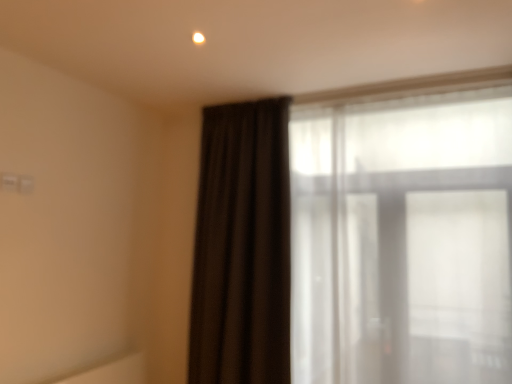
Where is `transparent glass window at center`? transparent glass window at center is located at coordinates (403, 236).

What is the approximate height of transparent glass window at center?

transparent glass window at center is 1.80 meters in height.

This screenshot has height=384, width=512. Describe the element at coordinates (403, 236) in the screenshot. I see `transparent glass window at center` at that location.

Locate an element on the screen. This screenshot has height=384, width=512. transparent glass window at center is located at coordinates (403, 236).